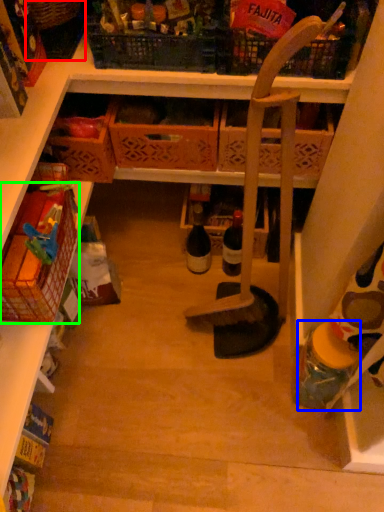
Question: Based on their relative distances, which object is nearer to basket (highlighted by a red box)? Choose from bottle (highlighted by a blue box) and basket (highlighted by a green box).

Choices:
 (A) bottle
 (B) basket

Answer: (B)